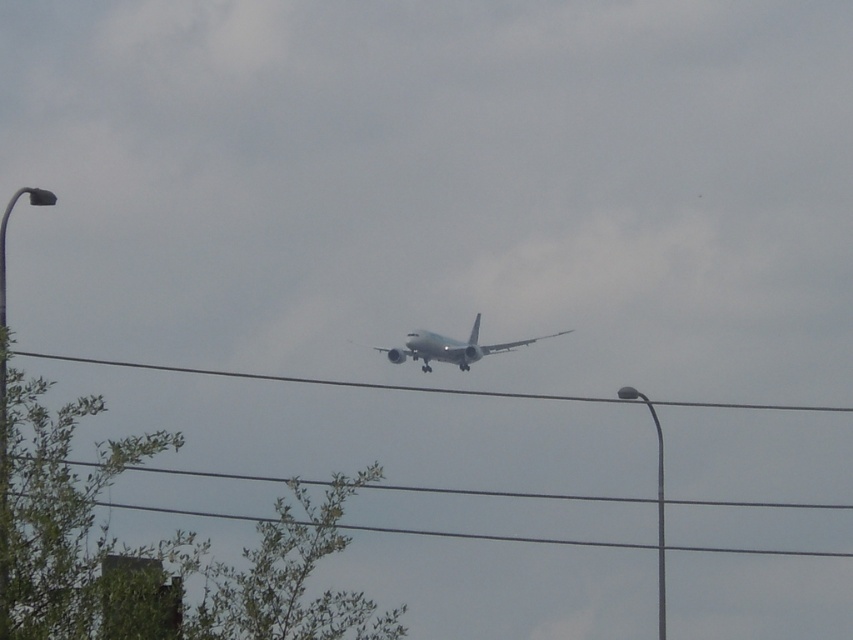
Question: Among these points, which one is nearest to the camera?

Choices:
 (A) (68, 589)
 (B) (662, 401)

Answer: (A)

Question: Does green leafy tree at lower left have a greater width compared to black wire at center?

Choices:
 (A) no
 (B) yes

Answer: (A)

Question: Which of the following is the closest to the observer?

Choices:
 (A) black wire at center
 (B) white matte airplane at center

Answer: (A)

Question: Does black wire at center appear over white matte airplane at center?

Choices:
 (A) no
 (B) yes

Answer: (A)

Question: Among these objects, which one is farthest from the camera?

Choices:
 (A) green leafy tree at lower left
 (B) black wire at center
 (C) white matte airplane at center

Answer: (C)

Question: Is green leafy tree at lower left above black wire at center?

Choices:
 (A) yes
 (B) no

Answer: (B)